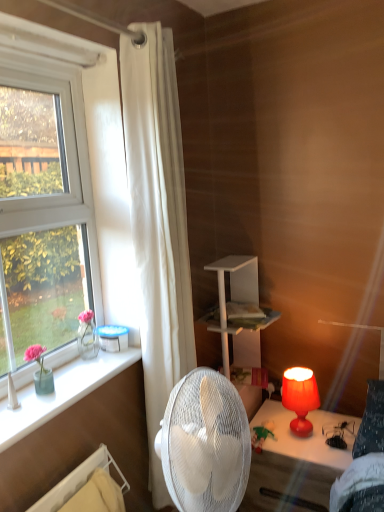
Question: Could you tell me if white fabric curtain at left is turned towards plush green bear at lower center?

Choices:
 (A) no
 (B) yes

Answer: (A)

Question: Does white fabric curtain at left have a lesser width compared to plush green bear at lower center?

Choices:
 (A) yes
 (B) no

Answer: (A)

Question: Is there a large distance between white fabric curtain at left and plush green bear at lower center?

Choices:
 (A) yes
 (B) no

Answer: (B)

Question: Is white fabric curtain at left in front of plush green bear at lower center?

Choices:
 (A) no
 (B) yes

Answer: (B)

Question: Is plush green bear at lower center completely or partially inside white fabric curtain at left?

Choices:
 (A) no
 (B) yes

Answer: (A)

Question: Looking at the image, does plush green bear at lower center seem bigger or smaller compared to white fabric curtain at left?

Choices:
 (A) small
 (B) big

Answer: (A)

Question: Does point (259, 429) appear closer or farther from the camera than point (188, 308)?

Choices:
 (A) farther
 (B) closer

Answer: (A)

Question: From the image's perspective, is plush green bear at lower center located above or below white fabric curtain at left?

Choices:
 (A) above
 (B) below

Answer: (B)

Question: From a real-world perspective, relative to white fabric curtain at left, is plush green bear at lower center vertically above or below?

Choices:
 (A) above
 (B) below

Answer: (B)

Question: Is matte orange lampshade at lower right wider or thinner than plush green bear at lower center?

Choices:
 (A) thin
 (B) wide

Answer: (A)

Question: Looking at the image, does matte orange lampshade at lower right seem bigger or smaller compared to plush green bear at lower center?

Choices:
 (A) small
 (B) big

Answer: (B)

Question: From a real-world perspective, is matte orange lampshade at lower right positioned above or below plush green bear at lower center?

Choices:
 (A) above
 (B) below

Answer: (A)

Question: Is matte orange lampshade at lower right in front of or behind plush green bear at lower center in the image?

Choices:
 (A) behind
 (B) front

Answer: (B)

Question: Which is correct: white fabric curtain at left is inside clear glass vase at left, or outside of it?

Choices:
 (A) inside
 (B) outside

Answer: (B)

Question: Does point (140, 328) appear closer or farther from the camera than point (66, 377)?

Choices:
 (A) closer
 (B) farther

Answer: (B)